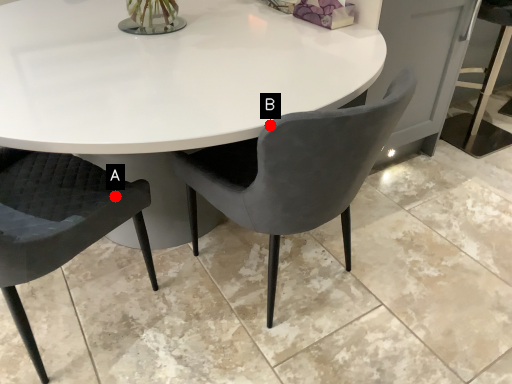
Question: Two points are circled on the image, labeled by A and B beside each circle. Which point is closer to the camera?

Choices:
 (A) A is closer
 (B) B is closer

Answer: (B)